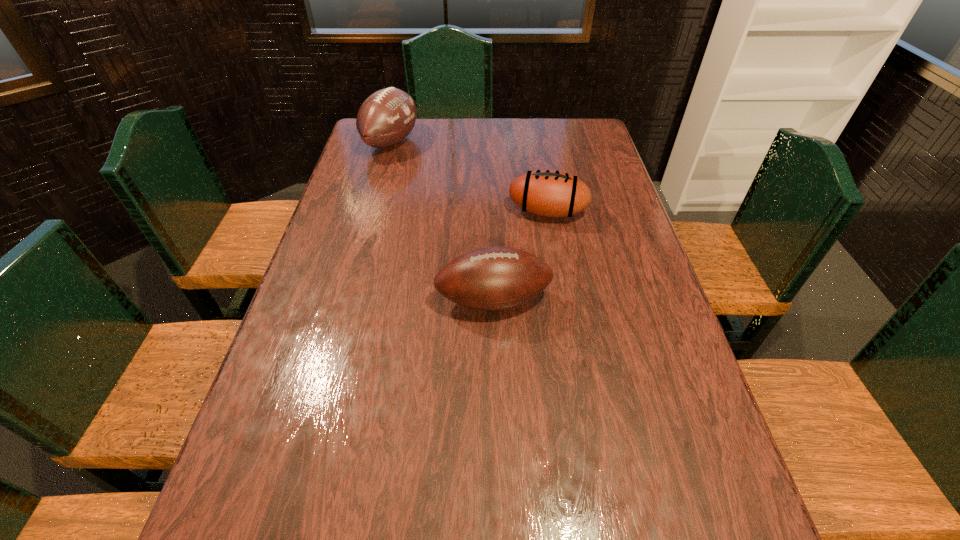
Locate an element on the screen. free space in the image that satisfies the following two spatial constraints: 1. on the front side of the nearest football (American); 2. on the right side of the tallest football (American) is located at coordinates pos(348,300).